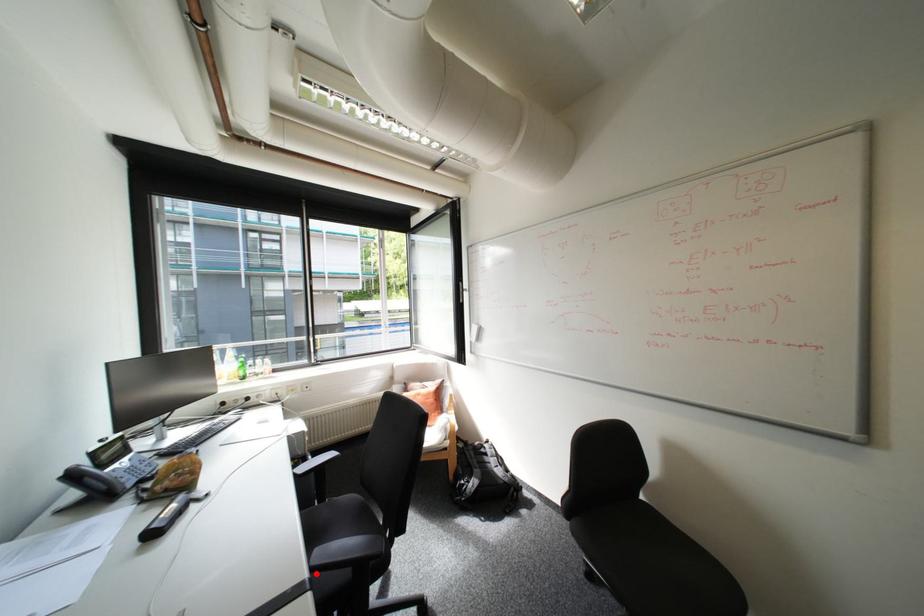
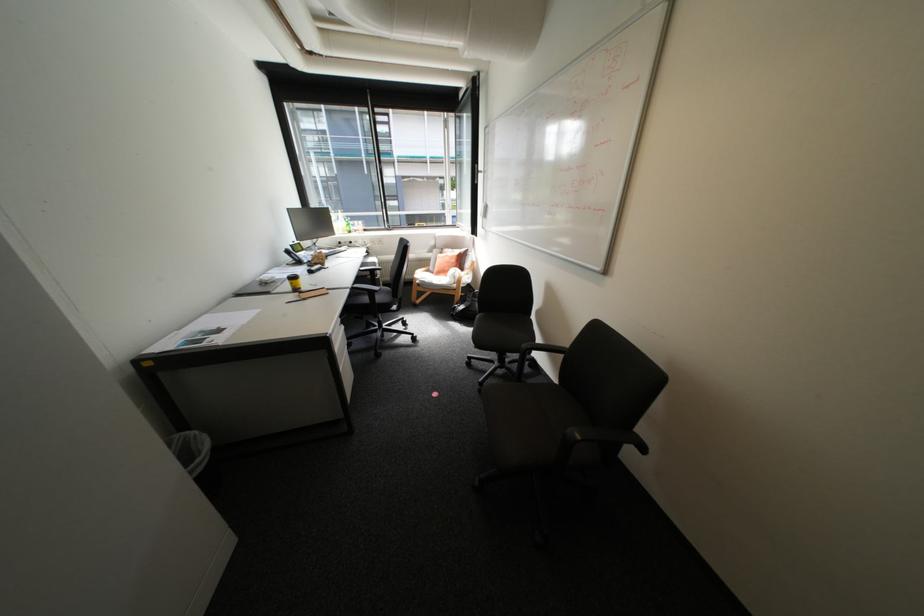
In the second image, find the point that corresponds to the highlighted location in the first image.

(359, 286)